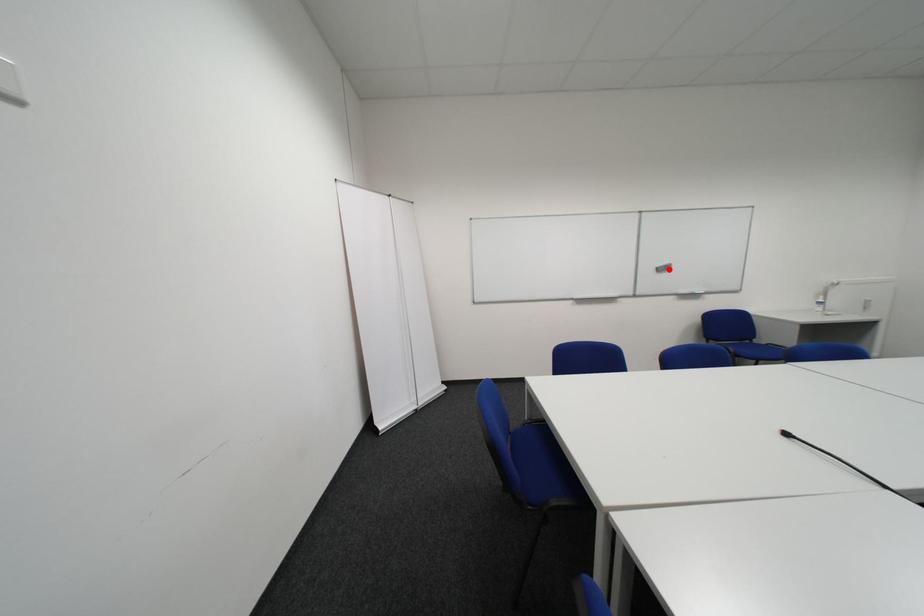
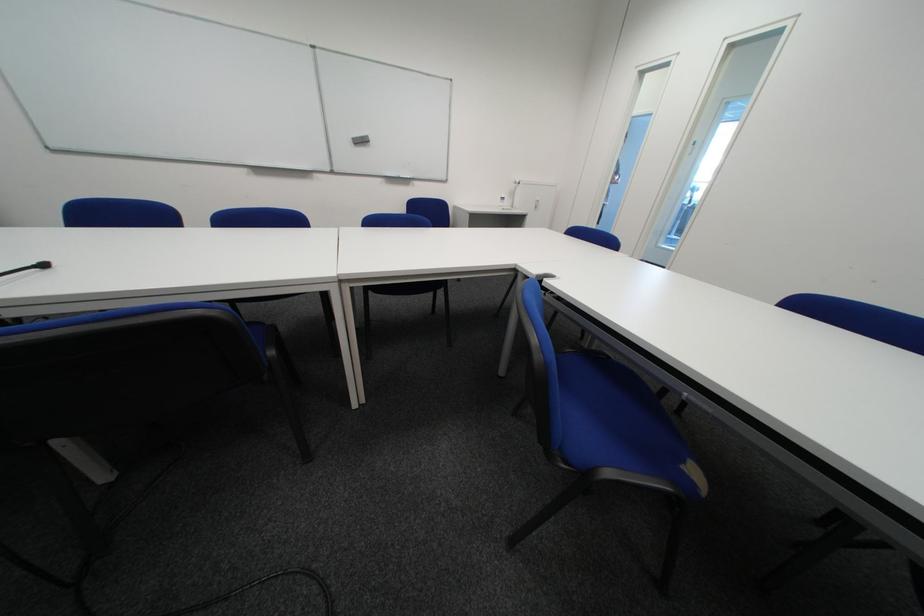
Question: I am providing you with two images of the same scene from different viewpoints. Given a red point in image1, look at the same physical point in image2. Is it:

Choices:
 (A) Closer to the viewpoint
 (B) Farther from the viewpoint

Answer: (A)